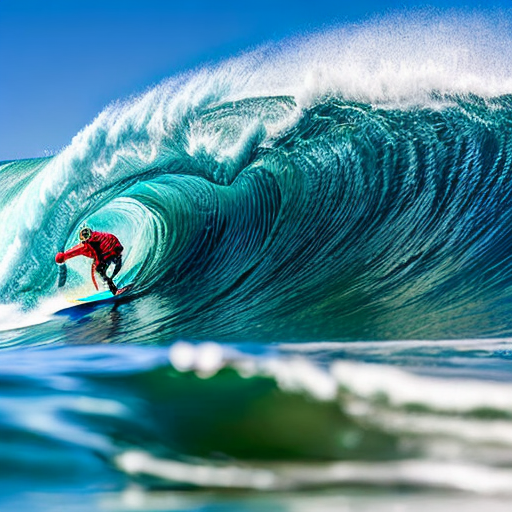
This screenshot has width=512, height=512. Find the location of `foam`. foam is located at coordinates (356, 75).